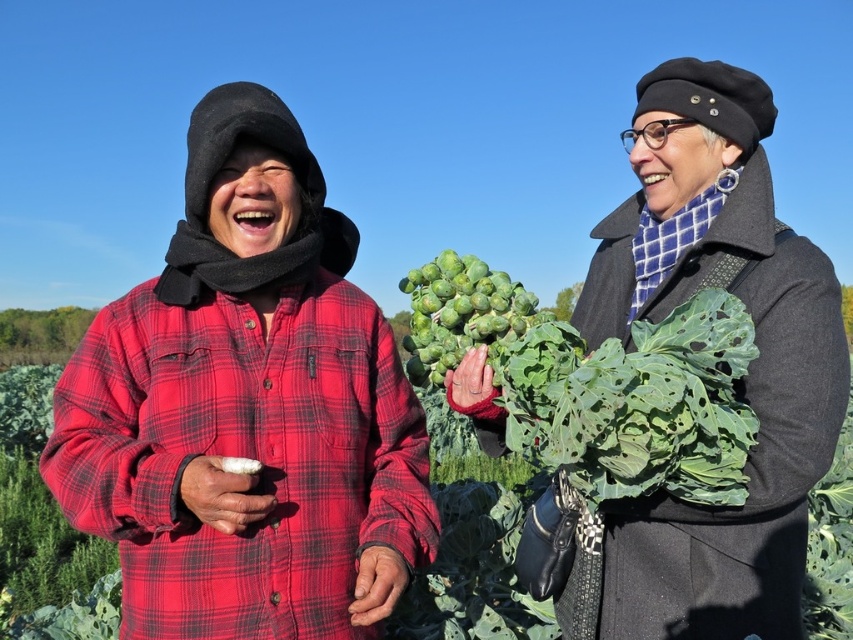
Based on the scene description, which object is wider, the green leafy vegetable at center or the green matte brussels sprouts at center?

The green leafy vegetable at center is wider than the green matte brussels sprouts at center according to the description.

You are a food critic trying to determine which item is larger between the green matte brussels sprouts at center and the white fluffy food at center. Based on the scene, which one is wider?

The green matte brussels sprouts at center might be wider than white fluffy food at center according to the description.